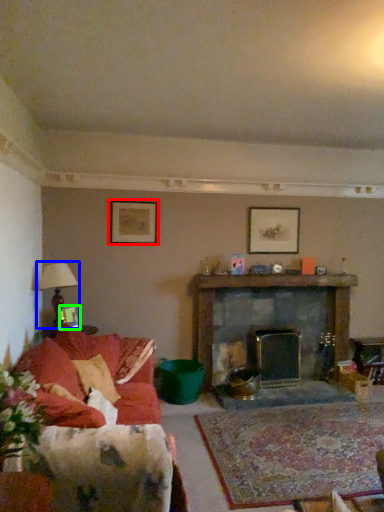
Question: Which is farther away from picture frame (highlighted by a red box)? lamp (highlighted by a blue box) or picture frame (highlighted by a green box)?

Choices:
 (A) lamp
 (B) picture frame

Answer: (B)